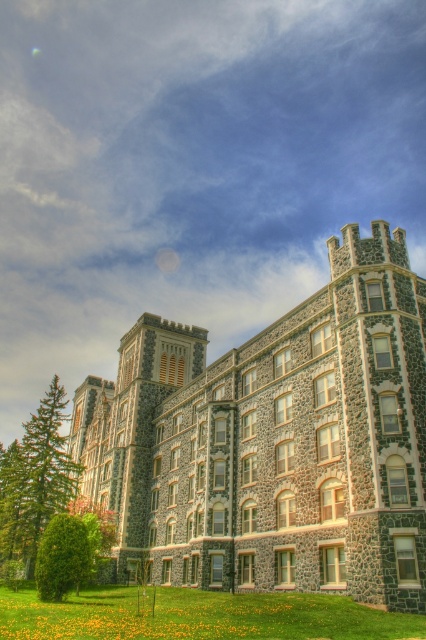
Question: Which object appears closest to the camera in this image?

Choices:
 (A) green grass at lower center
 (B) green leafy tree at lower left
 (C) green textured pine tree at left

Answer: (A)

Question: Based on their relative distances, which object is nearer to the green leafy tree at lower left?

Choices:
 (A) green textured pine tree at left
 (B) green grass at lower center

Answer: (B)

Question: Is green grass at lower center above green leafy tree at lower left?

Choices:
 (A) no
 (B) yes

Answer: (A)

Question: Where is green grass at lower center located in relation to green leafy tree at lower left in the image?

Choices:
 (A) left
 (B) right

Answer: (B)

Question: Considering the relative positions of green grass at lower center and green leafy tree at lower left in the image provided, where is green grass at lower center located with respect to green leafy tree at lower left?

Choices:
 (A) above
 (B) below

Answer: (B)

Question: Which object is closer to the camera taking this photo?

Choices:
 (A) green grass at lower center
 (B) green textured pine tree at left

Answer: (A)